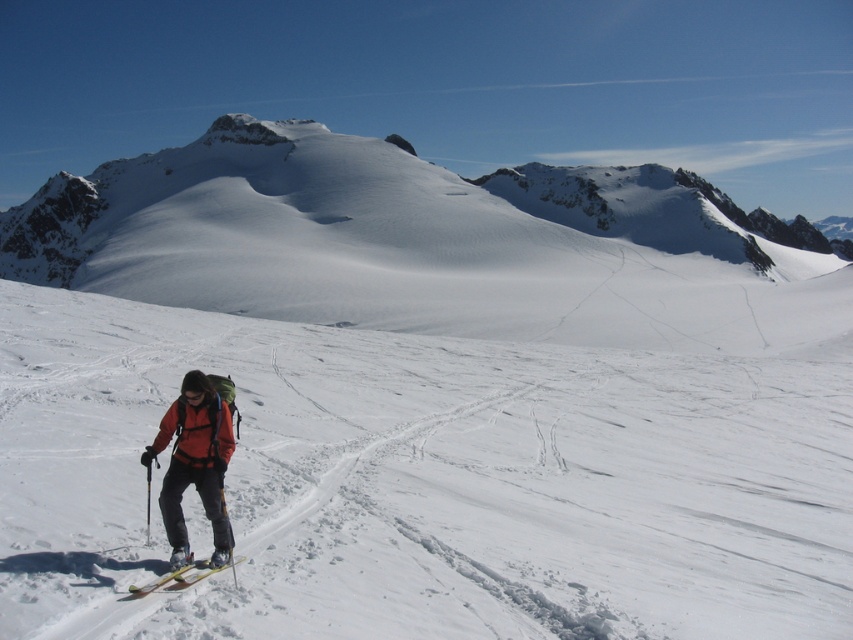
Question: Which point is closer to the camera?

Choices:
 (A) white snow-covered mountain at center
 (B) orange softshell jacket at lower left
 (C) yellow matte ski at lower left
 (D) white powder snow at center

Answer: (D)

Question: Among these objects, which one is farthest from the camera?

Choices:
 (A) white snow-covered mountain at center
 (B) yellow matte ski at lower left
 (C) orange softshell jacket at lower left
 (D) white powder snow at center

Answer: (A)

Question: Is white snow-covered mountain at center smaller than orange softshell jacket at lower left?

Choices:
 (A) no
 (B) yes

Answer: (A)

Question: Which point is closer to the camera taking this photo?

Choices:
 (A) (775, 292)
 (B) (741, 380)
 (C) (241, 557)

Answer: (C)

Question: Is white snow-covered mountain at center to the right of orange softshell jacket at lower left from the viewer's perspective?

Choices:
 (A) yes
 (B) no

Answer: (A)

Question: Can you confirm if white powder snow at center is positioned below white snow-covered mountain at center?

Choices:
 (A) yes
 (B) no

Answer: (A)